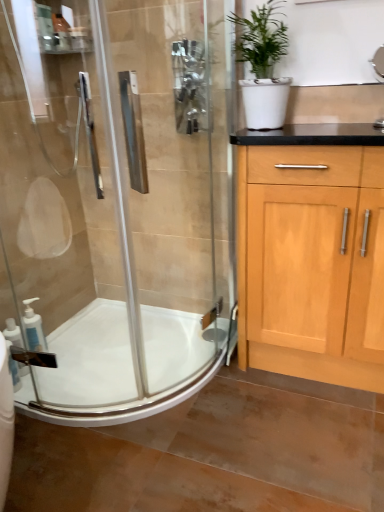
Question: Is white glossy sink at upper right smaller than white matte soap dispenser at lower left, the 1th soap dispenser positioned from the back?

Choices:
 (A) no
 (B) yes

Answer: (A)

Question: From a real-world perspective, is white glossy sink at upper right below white matte soap dispenser at lower left, the 1th soap dispenser positioned from the back?

Choices:
 (A) yes
 (B) no

Answer: (B)

Question: Can you confirm if white glossy sink at upper right is taller than white matte soap dispenser at lower left, the 2th soap dispenser from the front?

Choices:
 (A) no
 (B) yes

Answer: (A)

Question: Considering the relative sizes of white glossy sink at upper right and white matte soap dispenser at lower left, the 1th soap dispenser positioned from the back, in the image provided, is white glossy sink at upper right shorter than white matte soap dispenser at lower left, the 1th soap dispenser positioned from the back,?

Choices:
 (A) yes
 (B) no

Answer: (A)

Question: Is white glossy sink at upper right far from white matte soap dispenser at lower left, the 2th soap dispenser from the front?

Choices:
 (A) no
 (B) yes

Answer: (B)

Question: Considering the relative sizes of white glossy sink at upper right and white matte soap dispenser at lower left, the 2th soap dispenser from the front, in the image provided, is white glossy sink at upper right wider than white matte soap dispenser at lower left, the 2th soap dispenser from the front,?

Choices:
 (A) yes
 (B) no

Answer: (A)

Question: Does white matte pot at upper right come behind white glossy bath at lower left?

Choices:
 (A) no
 (B) yes

Answer: (A)

Question: Is white matte pot at upper right at the right side of white glossy bath at lower left?

Choices:
 (A) no
 (B) yes

Answer: (B)

Question: Is white matte pot at upper right completely or partially outside of white glossy bath at lower left?

Choices:
 (A) yes
 (B) no

Answer: (A)

Question: Can you confirm if white matte pot at upper right is thinner than white glossy bath at lower left?

Choices:
 (A) yes
 (B) no

Answer: (A)

Question: Are white matte pot at upper right and white glossy bath at lower left located far from each other?

Choices:
 (A) no
 (B) yes

Answer: (B)

Question: Does white matte pot at upper right turn towards white glossy bath at lower left?

Choices:
 (A) yes
 (B) no

Answer: (B)

Question: Considering the relative sizes of clear glass shower door at left and white glossy soap dispenser at lower left, the second soap dispenser in the back-to-front sequence, in the image provided, is clear glass shower door at left shorter than white glossy soap dispenser at lower left, the second soap dispenser in the back-to-front sequence,?

Choices:
 (A) yes
 (B) no

Answer: (B)